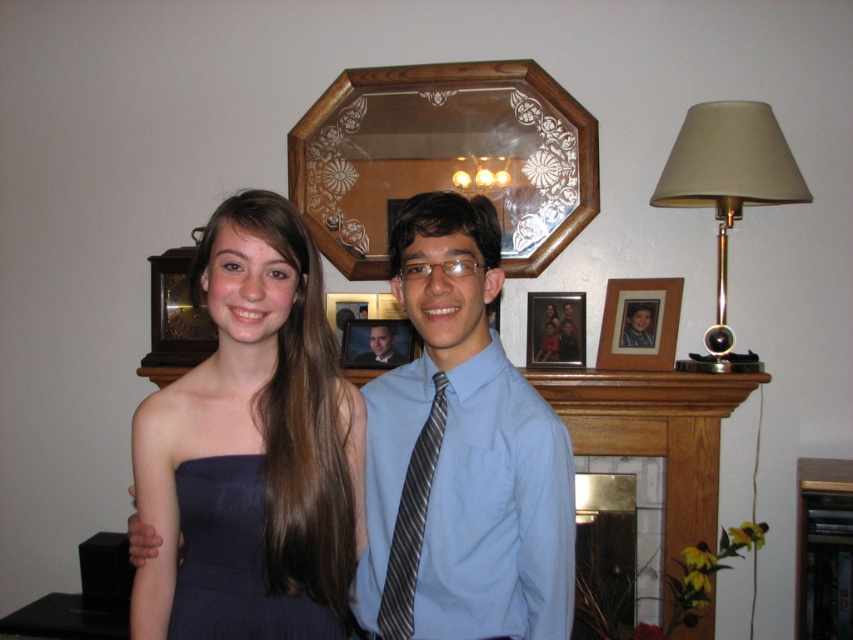
In the scene shown: You are taking a photo of the matte blue dress at center and the striped fabric tie at center. Which object will appear larger in the photo?

The matte blue dress at center will appear larger in the photo because it is closer to the viewer than the striped fabric tie at center.

You are standing in the living room and want to place a new photo frame on the mantel. The photo frame has coordinates set to be placed at point 0.7, 0.3. Is there enough space between the matte blue dress at center and the large octagonal mirror to place the photo frame?

The matte blue dress at center is located at point (256, 444), which is very close to the desired coordinates (254, 448). There might not be enough space between the matte blue dress at center and the large octagonal mirror to place the photo frame without overlapping.

You are arranging a photo shoot in this living room and need to ensure that the blue satin shirt at center and the beige fabric lampshade at right are both visible in the frame. Given their sizes, which object might require more strategic placement to ensure it doesn

The beige fabric lampshade at right is larger than the blue satin shirt at center, so it might require more strategic placement to ensure it fits within the photo frame.